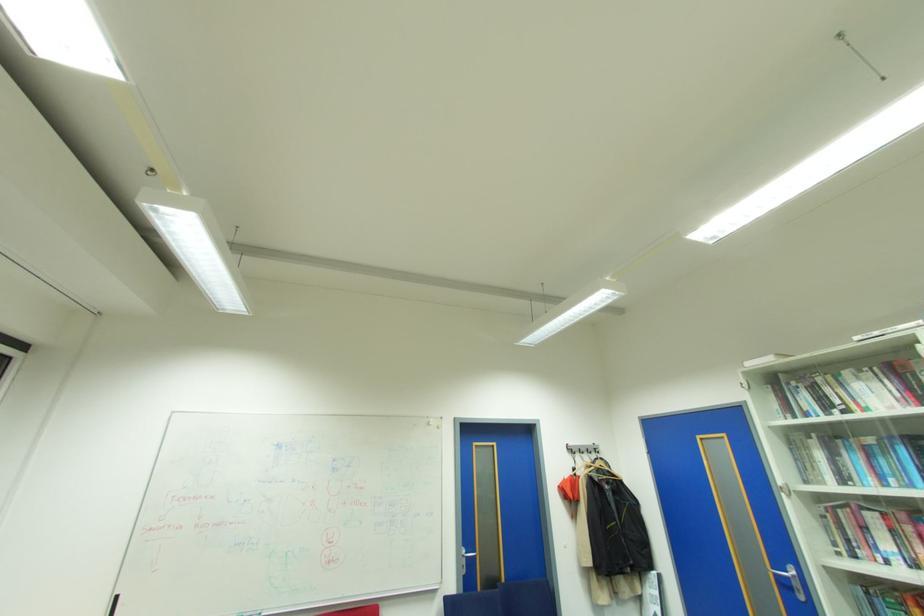
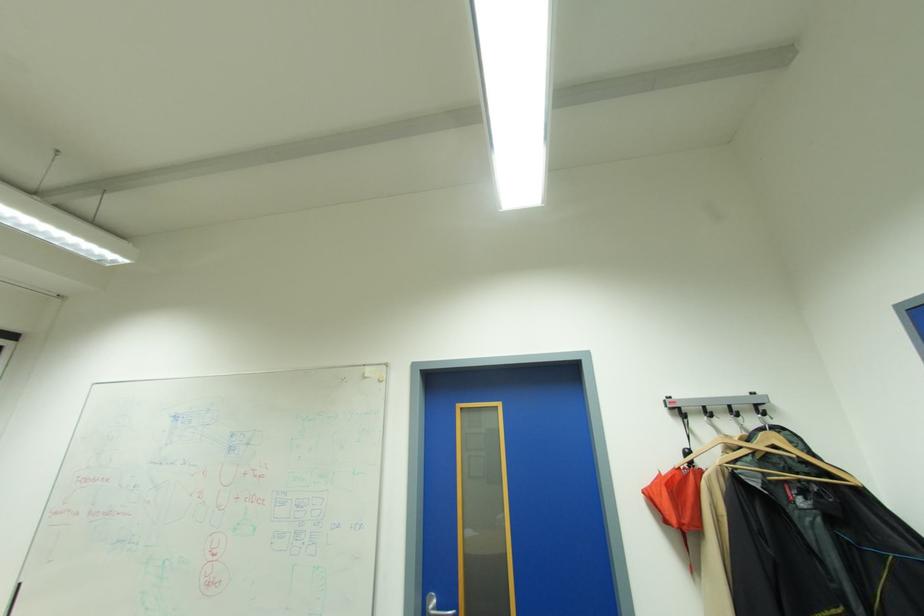
Find the pixel in the second image that matches point (601, 456) in the first image.

(768, 421)